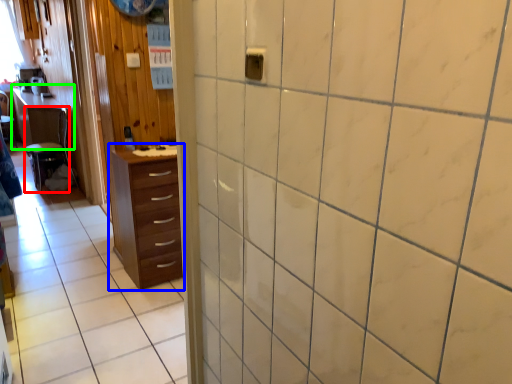
Question: Which object is positioned closest to furniture (highlighted by a red box)? Select from chest of drawers (highlighted by a blue box) and table (highlighted by a green box).

Choices:
 (A) chest of drawers
 (B) table

Answer: (B)